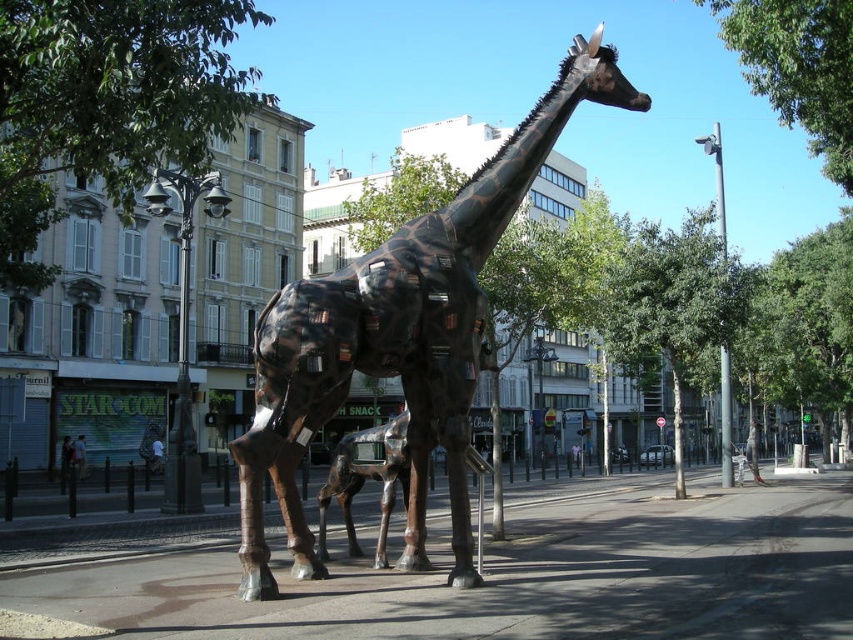
Question: Which object appears farthest from the camera in this image?

Choices:
 (A) green leafy tree at center
 (B) concrete pavement at center
 (C) bronze textured giraffe at center
 (D) green leafy tree at upper center

Answer: (A)

Question: Which of the following is the closest to the observer?

Choices:
 (A) (654, 358)
 (B) (518, 579)

Answer: (B)

Question: Does green leafy tree at upper left appear under green leafy tree at upper center?

Choices:
 (A) no
 (B) yes

Answer: (B)

Question: Can you confirm if concrete pavement at center is positioned to the left of green leafy tree at center?

Choices:
 (A) yes
 (B) no

Answer: (A)

Question: Which point is closer to the camera taking this photo?

Choices:
 (A) (114, 186)
 (B) (784, 3)
 (C) (743, 488)
 (D) (613, 353)

Answer: (A)

Question: Is bronze textured giraffe at center positioned before green leafy tree at center?

Choices:
 (A) no
 (B) yes

Answer: (B)